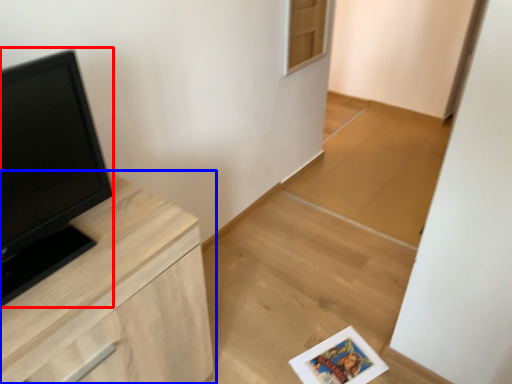
Question: Among these objects, which one is farthest to the camera, open (highlighted by a red box) or chest of drawers (highlighted by a blue box)?

Choices:
 (A) open
 (B) chest of drawers

Answer: (B)